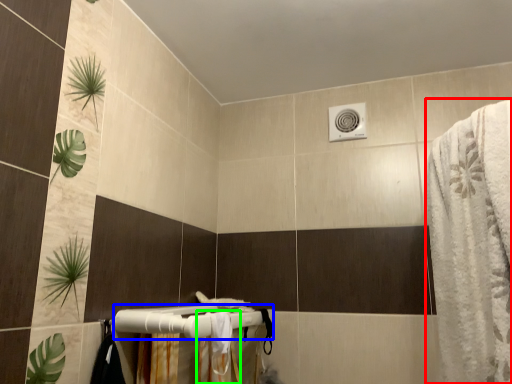
Question: Considering the real-world distances, which object is closest to bath towel (highlighted by a red box)? towel bar (highlighted by a blue box) or shower curtain (highlighted by a green box).

Choices:
 (A) towel bar
 (B) shower curtain

Answer: (B)